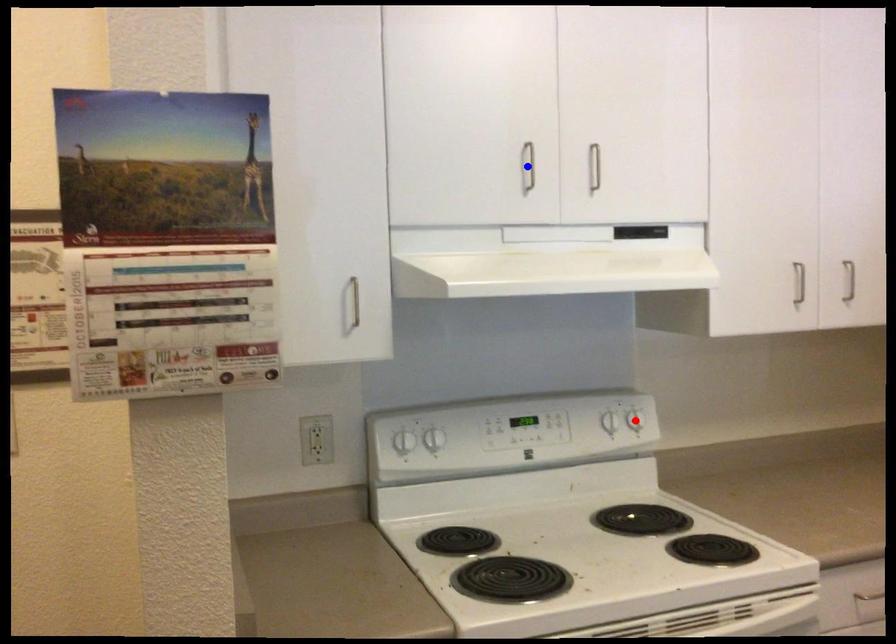
Question: Two points are marked on the image. Which point is closer to the camera?

Choices:
 (A) Blue point is closer.
 (B) Red point is closer.

Answer: (A)